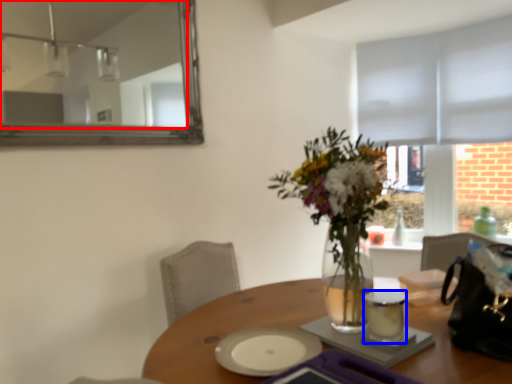
Question: Which point is closer to the camera, mirror (highlighted by a red box) or tableware (highlighted by a blue box)?

Choices:
 (A) mirror
 (B) tableware

Answer: (B)